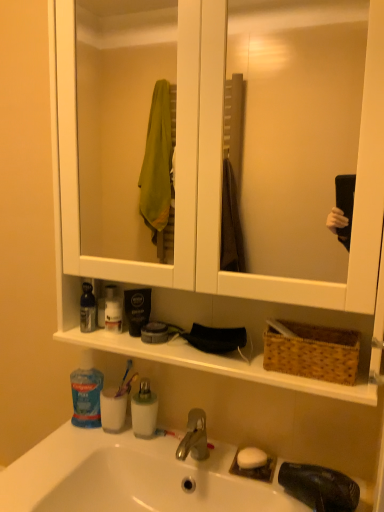
Question: Based on their positions, is brown woven basket at right located to the left or right of white matte soap at sink?

Choices:
 (A) right
 (B) left

Answer: (A)

Question: Relative to white matte soap at sink, is brown woven basket at right in front or behind?

Choices:
 (A) behind
 (B) front

Answer: (B)

Question: Considering the real-world distances, which object is closest to the white matte lotion at center, placed as the 2th toiletry when sorted from bottom to top?

Choices:
 (A) translucent plastic toothbrush at lower center, which is the 1th toothbrush in top-to-bottom order
 (B) blue translucent mouthwash at lower left, arranged as the 2th mouthwash when viewed from the right
 (C) brown woven basket at right
 (D) translucent plastic bottle at shelf left
 (E) blue plastic toothpaste at lower left, the first toiletry positioned from the bottom

Answer: (D)

Question: Estimate the real-world distances between objects in this image. Which object is closer to the translucent plastic bottle at shelf left?

Choices:
 (A) white matte lotion at center, placed as the 2th toiletry when sorted from bottom to top
 (B) translucent plastic toothbrush at lower center, placed as the first toothbrush when sorted from back to front
 (C) white opaque bottle at center, which is the first mouthwash in right-to-left order
 (D) blue translucent mouthwash at lower left, arranged as the 2th mouthwash when viewed from the right
 (E) white matte soap at sink

Answer: (A)